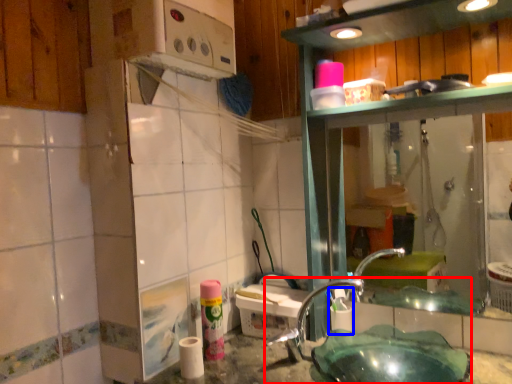
Question: Which object is closer to the camera taking this photo, sink (highlighted by a red box) or shaving cream (highlighted by a blue box)?

Choices:
 (A) sink
 (B) shaving cream

Answer: (A)